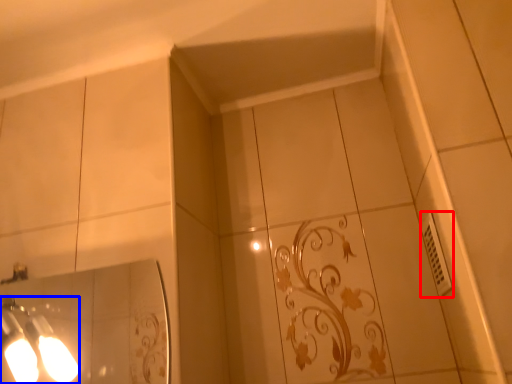
Question: Which point is closer to the camera, electric outlet (highlighted by a red box) or light fixture (highlighted by a blue box)?

Choices:
 (A) electric outlet
 (B) light fixture

Answer: (B)